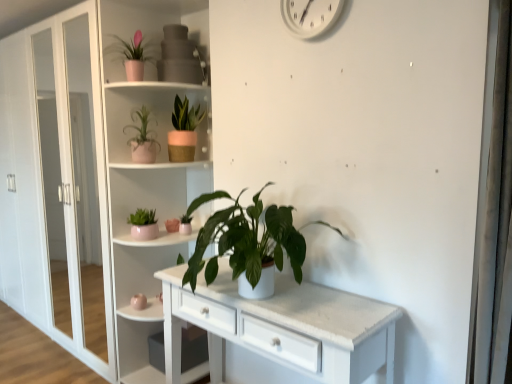
Question: Is the surface of green matte plant at center, the first houseplant from the bottom, in direct contact with white plastic clock at upper center?

Choices:
 (A) no
 (B) yes

Answer: (A)

Question: Can white plastic clock at upper center be found inside green matte plant at center, arranged as the fifth houseplant when viewed from the top?

Choices:
 (A) no
 (B) yes

Answer: (A)

Question: Considering the relative sizes of green matte plant at center, arranged as the fifth houseplant when viewed from the top, and white plastic clock at upper center in the image provided, is green matte plant at center, arranged as the fifth houseplant when viewed from the top, thinner than white plastic clock at upper center?

Choices:
 (A) no
 (B) yes

Answer: (A)

Question: Can you confirm if green matte plant at center, arranged as the fifth houseplant when viewed from the top, is positioned to the left of white plastic clock at upper center?

Choices:
 (A) no
 (B) yes

Answer: (B)

Question: Does green matte plant at center, the first houseplant from the bottom, appear on the right side of white plastic clock at upper center?

Choices:
 (A) yes
 (B) no

Answer: (B)

Question: Based on their positions, is white glossy shelves at center located to the left or right of matte pink pot at upper left, placed as the fifth houseplant when sorted from bottom to top?

Choices:
 (A) left
 (B) right

Answer: (B)

Question: Considering the positions of white glossy shelves at center and matte pink pot at upper left, placed as the fifth houseplant when sorted from bottom to top, in the image, is white glossy shelves at center taller or shorter than matte pink pot at upper left, placed as the fifth houseplant when sorted from bottom to top,?

Choices:
 (A) short
 (B) tall

Answer: (B)

Question: Is white glossy shelves at center inside the boundaries of matte pink pot at upper left, placed as the fifth houseplant when sorted from bottom to top, or outside?

Choices:
 (A) outside
 (B) inside

Answer: (A)

Question: From the image's perspective, is white glossy shelves at center above or below matte pink pot at upper left, marked as the 1th houseplant in a top-to-bottom arrangement?

Choices:
 (A) below
 (B) above

Answer: (A)

Question: From the image's perspective, relative to matte pink pot at upper left, placed as the fifth houseplant when sorted from bottom to top, is pink matte pot at upper center, the fourth houseplant positioned from the bottom, above or below?

Choices:
 (A) below
 (B) above

Answer: (A)

Question: From a real-world perspective, is pink matte pot at upper center, the fourth houseplant positioned from the bottom, above or below matte pink pot at upper left, marked as the 1th houseplant in a top-to-bottom arrangement?

Choices:
 (A) below
 (B) above

Answer: (A)

Question: Considering their positions, is pink matte pot at upper center, placed as the second houseplant when sorted from top to bottom, located in front of or behind matte pink pot at upper left, placed as the fifth houseplant when sorted from bottom to top?

Choices:
 (A) behind
 (B) front

Answer: (A)

Question: In terms of height, does pink matte pot at upper center, the fourth houseplant positioned from the bottom, look taller or shorter compared to matte pink pot at upper left, marked as the 1th houseplant in a top-to-bottom arrangement?

Choices:
 (A) short
 (B) tall

Answer: (B)

Question: Considering the positions of white plastic clock at upper center and matte pink pot at upper center, which is counted as the 3th houseplant, starting from the bottom, in the image, is white plastic clock at upper center wider or thinner than matte pink pot at upper center, which is counted as the 3th houseplant, starting from the bottom,?

Choices:
 (A) thin
 (B) wide

Answer: (A)

Question: In the image, is white plastic clock at upper center positioned in front of or behind matte pink pot at upper center, placed as the third houseplant when sorted from top to bottom?

Choices:
 (A) behind
 (B) front

Answer: (B)